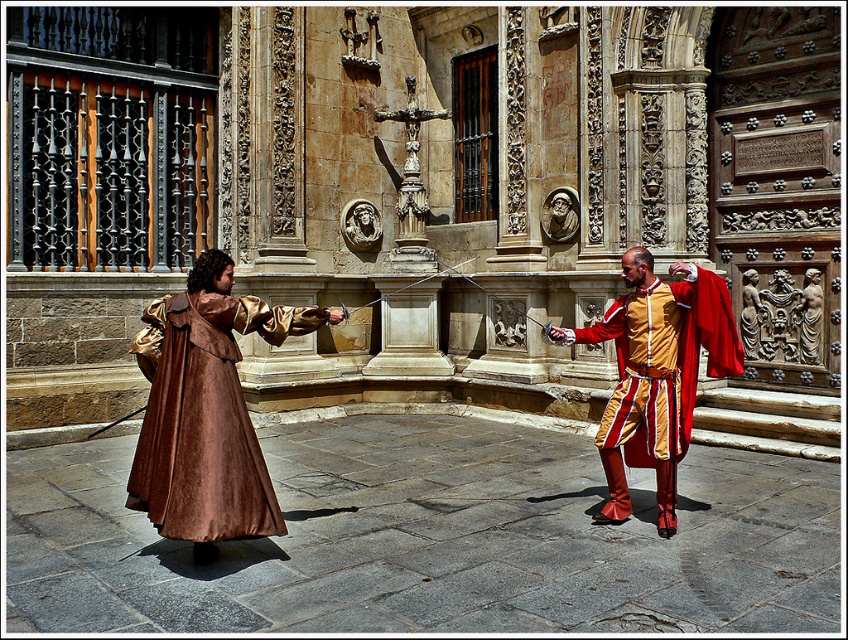
Question: Can you confirm if brown suede cloak at center is positioned below matte gold tunic at center?

Choices:
 (A) yes
 (B) no

Answer: (A)

Question: Which point appears closest to the camera in this image?

Choices:
 (A) (250, 525)
 (B) (667, 358)

Answer: (A)

Question: Is brown suede cloak at center bigger than matte gold tunic at center?

Choices:
 (A) yes
 (B) no

Answer: (B)

Question: Which point appears closest to the camera in this image?

Choices:
 (A) (236, 467)
 (B) (718, 340)

Answer: (A)

Question: Which object appears closest to the camera in this image?

Choices:
 (A) brown suede cloak at center
 (B) matte gold tunic at center

Answer: (A)

Question: Can you confirm if brown suede cloak at center is positioned above matte gold tunic at center?

Choices:
 (A) no
 (B) yes

Answer: (A)